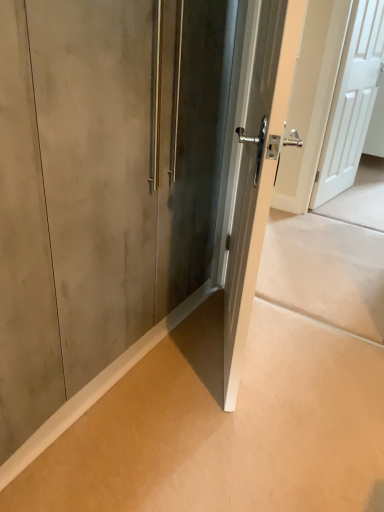
Question: Considering the positions of satin silver door at center, placed as the 1th door when sorted from left to right, and matte concrete wall at lower left in the image, is satin silver door at center, placed as the 1th door when sorted from left to right, taller or shorter than matte concrete wall at lower left?

Choices:
 (A) tall
 (B) short

Answer: (A)

Question: Based on their sizes in the image, would you say satin silver door at center, the 2th door positioned from the back, is bigger or smaller than matte concrete wall at lower left?

Choices:
 (A) small
 (B) big

Answer: (B)

Question: Estimate the real-world distances between objects in this image. Which object is farther from the satin silver door at center, the 2th door positioned from the back?

Choices:
 (A) matte concrete wall at lower left
 (B) white matte door at upper right, which ranks as the 2th door in front-to-back order

Answer: (B)

Question: Estimate the real-world distances between objects in this image. Which object is closer to the matte concrete wall at lower left?

Choices:
 (A) white matte door at upper right, the 1th door from the back
 (B) satin silver door at center, arranged as the 2th door when viewed from the right

Answer: (B)